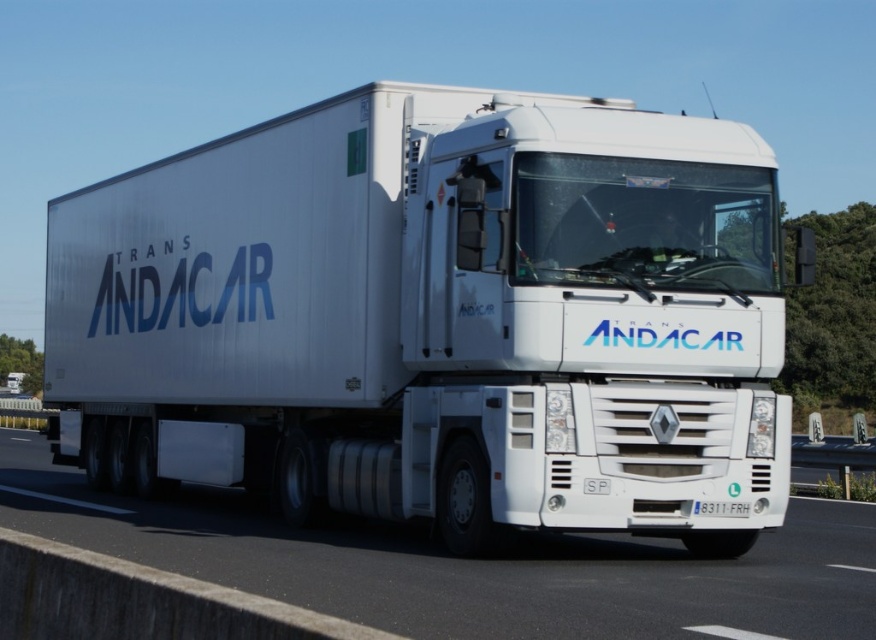
Question: Does white asphalt road at center come behind white plastic license plate at center?

Choices:
 (A) no
 (B) yes

Answer: (A)

Question: Among these points, which one is nearest to the camera?

Choices:
 (A) (743, 506)
 (B) (373, 609)

Answer: (B)

Question: From the image, what is the correct spatial relationship of white glossy truck at center in relation to white asphalt road at center?

Choices:
 (A) below
 (B) above

Answer: (B)

Question: Among these objects, which one is farthest from the camera?

Choices:
 (A) white glossy truck at center
 (B) white asphalt road at center

Answer: (A)

Question: Can you confirm if white asphalt road at center is wider than white plastic license plate at center?

Choices:
 (A) yes
 (B) no

Answer: (A)

Question: Which object is closer to the camera taking this photo?

Choices:
 (A) white plastic license plate at center
 (B) white glossy truck at center

Answer: (B)